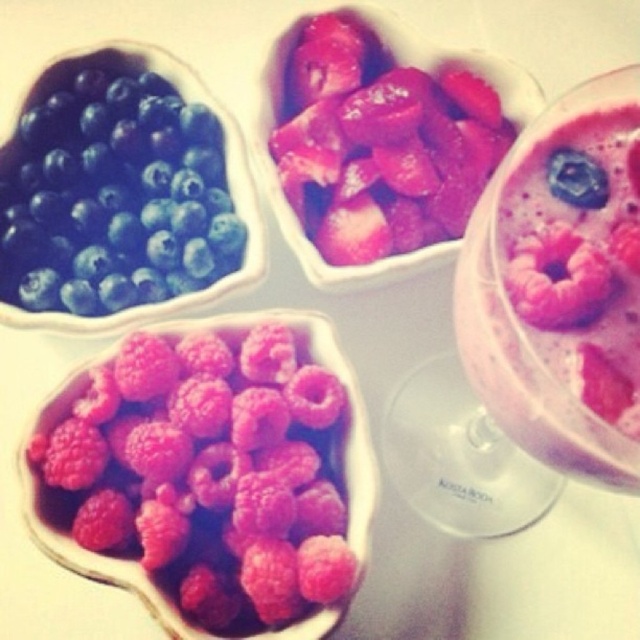
You are standing in front of the berry display and want to pick up the item closer to you. Which point should you reach for, point (102, 112) or point (554, 310)?

Point (102, 112) is further to the viewer than point (554, 310), so you should reach for point (102, 112) as it is closer to you.

Consider the image. You are standing in front of a vibrant display of berries and a smoothie. You need to locate the matte blueberry at upper left. Where exactly is it positioned in the image?

The matte blueberry at upper left is positioned at point coordinates of 0.309 on the x axis and 0.180 on the y axis.

From the picture: Where is the bright pink raspberry at center located in the image?

The bright pink raspberry at center is located at point (211, 472) in the image.